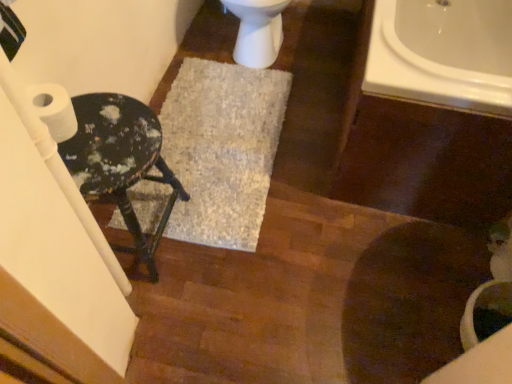
Image resolution: width=512 pixels, height=384 pixels. What are the coordinates of `empty space that is ontop of black painted stool at left (from a real-world perspective)` in the screenshot? It's located at (104, 139).